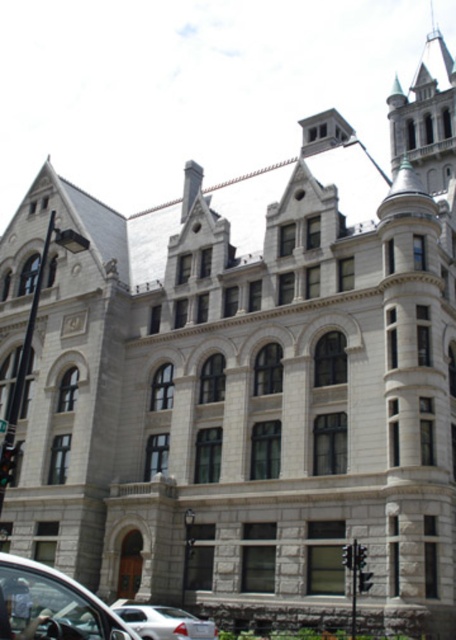
Question: From the image, what is the correct spatial relationship of metallic silver car at lower left in relation to white matte car at lower left?

Choices:
 (A) right
 (B) left

Answer: (B)

Question: Which point appears closest to the camera in this image?

Choices:
 (A) (350, 554)
 (B) (148, 628)
 (C) (363, 548)
 (D) (0, 458)

Answer: (D)

Question: Can you confirm if metallic traffic light at center is bigger than red glass traffic light at center?

Choices:
 (A) yes
 (B) no

Answer: (A)

Question: Which point appears farthest from the camera in this image?

Choices:
 (A) (351, 544)
 (B) (362, 580)
 (C) (5, 483)

Answer: (A)

Question: Does metallic silver car at lower left have a lesser width compared to red glass traffic light at center?

Choices:
 (A) no
 (B) yes

Answer: (A)

Question: Which object is farther from the camera taking this photo?

Choices:
 (A) white matte car at lower left
 (B) metallic traffic light at center
 (C) metallic traffic light at lower left
 (D) red plastic traffic light at center

Answer: (D)